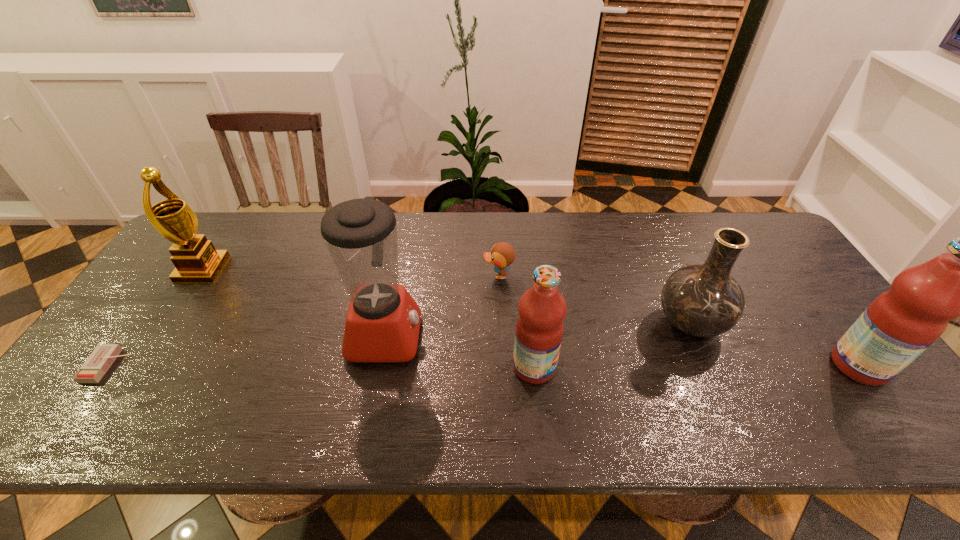
The image size is (960, 540). What are the coordinates of `free space for a new fruit juice on the left` in the screenshot? It's located at (207, 369).